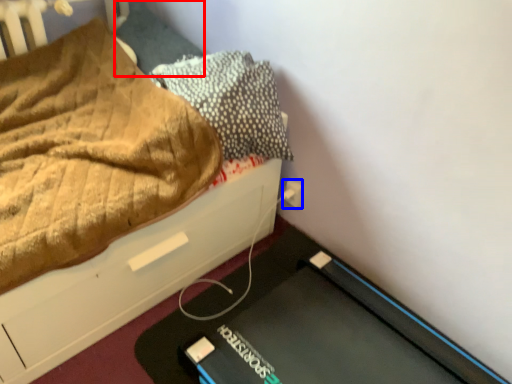
Question: Which point is closer to the camera, pillow (highlighted by a red box) or electric outlet (highlighted by a blue box)?

Choices:
 (A) pillow
 (B) electric outlet

Answer: (A)